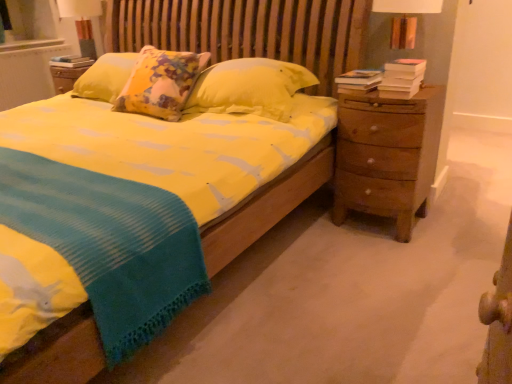
This screenshot has height=384, width=512. I want to click on yellow cotton bed at center, so click(290, 30).

In order to face hardcover book at upper left, which is the third book in right-to-left order, should I rotate leftwards or rightwards?

To align with it, rotate left about 23.364°.

Describe the element at coordinates (71, 61) in the screenshot. The image size is (512, 384). I see `hardcover book at upper left, acting as the third book starting from the front` at that location.

What is the approximate height of hardcover books at right, acting as the second book starting from the left?

The height of hardcover books at right, acting as the second book starting from the left, is 9.65 centimeters.

The height and width of the screenshot is (384, 512). I want to click on white textured radiator at upper left, so click(27, 70).

Consider the image. What is the approximate width of brown wooden nightstand at right?

It is 18.62 inches.

Image resolution: width=512 pixels, height=384 pixels. In order to click on yellow cotton bed at center in this screenshot , I will do `click(290, 30)`.

How many degrees apart are the facing directions of yellow cotton bed at center and white textured radiator at upper left?

The facing directions of yellow cotton bed at center and white textured radiator at upper left are 90.1 degrees apart.

Considering their positions, is yellow cotton bed at center located in front of or behind white textured radiator at upper left?

Clearly, yellow cotton bed at center is in front of white textured radiator at upper left.

The image size is (512, 384). I want to click on radiator behind the yellow cotton bed at center, so click(x=27, y=70).

From a real-world perspective, is yellow cotton bed at center physically below white textured radiator at upper left?

Indeed, from a real-world perspective, yellow cotton bed at center is positioned beneath white textured radiator at upper left.

Which object is further away from the camera, yellow cotton bed at center or brown wooden nightstand at right?

brown wooden nightstand at right is further away from the camera.

Between yellow cotton bed at center and brown wooden nightstand at right, which one appears on the right side from the viewer's perspective?

From the viewer's perspective, brown wooden nightstand at right appears more on the right side.

From a real-world perspective, is yellow cotton bed at center located higher than brown wooden nightstand at right?

Incorrect, from a real-world perspective, yellow cotton bed at center is lower than brown wooden nightstand at right.

Is yellow cotton bed at center facing towards brown wooden nightstand at right?

No, yellow cotton bed at center is not facing towards brown wooden nightstand at right.

Who is bigger, brown wooden nightstand at right or yellow cotton bed at center?

yellow cotton bed at center is bigger.

From the picture: Considering their positions, is brown wooden nightstand at right located in front of or behind yellow cotton bed at center?

brown wooden nightstand at right is behind yellow cotton bed at center.

From the image's perspective, is brown wooden nightstand at right located beneath yellow cotton bed at center?

Indeed, from the image's perspective, brown wooden nightstand at right is shown beneath yellow cotton bed at center.

Can you tell me how much brown wooden nightstand at right and yellow cotton bed at center differ in facing direction?

1.77 degrees separate the facing orientations of brown wooden nightstand at right and yellow cotton bed at center.

Is matte white lampshade at upper left oriented away from yellow cotton bed at center?

No, yellow cotton bed at center is not at the back of matte white lampshade at upper left.

From the image's perspective, is matte white lampshade at upper left located above or below yellow cotton bed at center?

matte white lampshade at upper left is above yellow cotton bed at center.

Is matte white lampshade at upper left located outside yellow cotton bed at center?

matte white lampshade at upper left is positioned outside yellow cotton bed at center.

From a real-world perspective, is matte white lampshade at upper left positioned above or below yellow cotton bed at center?

Clearly, from a real-world perspective, matte white lampshade at upper left is above yellow cotton bed at center.

Is point (367, 80) farther from camera compared to point (100, 6)?

No.

Can you confirm if hardcover books at right, the second book when ordered from right to left, is shorter than matte white lampshade at upper left?

Yes, hardcover books at right, the second book when ordered from right to left, is shorter than matte white lampshade at upper left.

Considering the sizes of hardcover books at right, which ranks as the 2th book in top-to-bottom order, and matte white lampshade at upper left in the image, is hardcover books at right, which ranks as the 2th book in top-to-bottom order, wider or thinner than matte white lampshade at upper left?

In the image, hardcover books at right, which ranks as the 2th book in top-to-bottom order, appears to be more narrow than matte white lampshade at upper left.

How many degrees apart are the facing directions of hardcover books at right, the second book when ordered from right to left, and matte white lampshade at upper left?

hardcover books at right, the second book when ordered from right to left, and matte white lampshade at upper left are facing 1.91 degrees away from each other.

From their relative heights in the image, would you say brown wooden nightstand at right is taller or shorter than hardcover books at right, the second book when ordered from right to left?

Considering their sizes, brown wooden nightstand at right has more height than hardcover books at right, the second book when ordered from right to left.

Considering the relative positions of brown wooden nightstand at right and hardcover books at right, acting as the second book starting from the left, in the image provided, is brown wooden nightstand at right behind hardcover books at right, acting as the second book starting from the left,?

No, brown wooden nightstand at right is closer to the viewer.

Measure the distance from brown wooden nightstand at right to hardcover books at right, the second book when ordered from right to left.

brown wooden nightstand at right is 32.32 centimeters from hardcover books at right, the second book when ordered from right to left.

From the image's perspective, is brown wooden nightstand at right over hardcover books at right, the second book when ordered from right to left?

No, from the image's perspective, brown wooden nightstand at right is not on top of hardcover books at right, the second book when ordered from right to left.

Is brown wooden nightstand at right positioned behind matte white lampshade at upper left?

No, it is not.

From the image's perspective, who appears lower, brown wooden nightstand at right or matte white lampshade at upper left?

brown wooden nightstand at right, from the image's perspective.

Who is bigger, brown wooden nightstand at right or matte white lampshade at upper left?

With larger size is brown wooden nightstand at right.

I want to click on bed below the white textured radiator at upper left (from a real-world perspective), so click(x=290, y=30).

Locate an element on the screen. nightstand lying on the right of yellow cotton bed at center is located at coordinates (387, 155).

Considering their positions, is matte white lampshade at upper left positioned closer to white textured radiator at upper left than brown wooden nightstand at right?

matte white lampshade at upper left lies closer to white textured radiator at upper left than the other object.

When comparing their distances from hardcover book at upper left, which appears as the first book when viewed from the left, does white textured radiator at upper left or hardcover book at right, placed as the first book when sorted from bottom to top, seem closer?

The object closer to hardcover book at upper left, which appears as the first book when viewed from the left, is white textured radiator at upper left.

When comparing their distances from hardcover book at right, placed as the first book when sorted from bottom to top, does brown wooden nightstand at right or white textured radiator at upper left seem closer?

Among the two, brown wooden nightstand at right is located nearer to hardcover book at right, placed as the first book when sorted from bottom to top.

Which object lies nearer to the anchor point white textured radiator at upper left, hardcover book at right, acting as the 3th book starting from the back, or brown wooden nightstand at right?

Based on the image, hardcover book at right, acting as the 3th book starting from the back, appears to be nearer to white textured radiator at upper left.

Considering their positions, is brown wooden nightstand at right positioned closer to hardcover books at right, the second book when ordered from right to left, than white textured radiator at upper left?

Among the two, brown wooden nightstand at right is located nearer to hardcover books at right, the second book when ordered from right to left.

Considering their positions, is matte white lampshade at upper left positioned further to yellow cotton bed at center than hardcover book at right, marked as the third book in a left-to-right arrangement?

The object further to yellow cotton bed at center is matte white lampshade at upper left.

Based on their spatial positions, is yellow cotton bed at center or white textured radiator at upper left further from hardcover books at right, the second book when ordered from right to left?

Among the two, white textured radiator at upper left is located further to hardcover books at right, the second book when ordered from right to left.

Which object lies nearer to the anchor point white textured radiator at upper left, brown wooden nightstand at right or hardcover books at right, acting as the second book starting from the left?

The object closer to white textured radiator at upper left is hardcover books at right, acting as the second book starting from the left.

This screenshot has width=512, height=384. What are the coordinates of `bedside lamp between white textured radiator at upper left and brown wooden nightstand at right` in the screenshot? It's located at (84, 23).

Where is `bedside lamp between white textured radiator at upper left and hardcover books at right, which is counted as the second book, starting from the front`? The height and width of the screenshot is (384, 512). bedside lamp between white textured radiator at upper left and hardcover books at right, which is counted as the second book, starting from the front is located at coordinates (84, 23).

Find the location of a particular element. nightstand between yellow cotton bed at center and matte white lampshade at upper left along the z-axis is located at coordinates (387, 155).

Where is `bedside lamp between yellow cotton bed at center and hardcover book at upper left, arranged as the first book when viewed from the back, along the z-axis`? The image size is (512, 384). bedside lamp between yellow cotton bed at center and hardcover book at upper left, arranged as the first book when viewed from the back, along the z-axis is located at coordinates (84, 23).